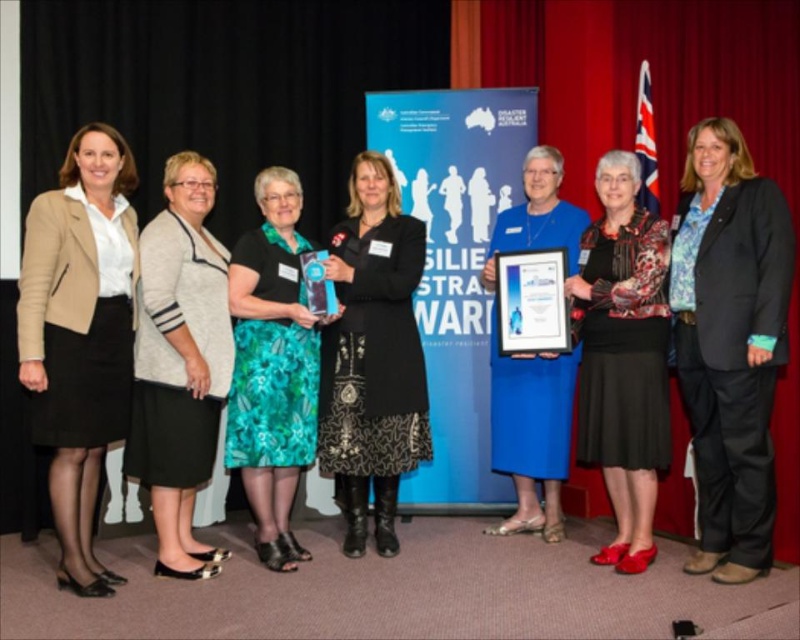
Question: Considering the relative positions of black textured dress at center and floral dress at center in the image provided, where is black textured dress at center located with respect to floral dress at center?

Choices:
 (A) right
 (B) left

Answer: (A)

Question: Can you confirm if beige fabric blazer at left is positioned above printed floral blouse at center?

Choices:
 (A) no
 (B) yes

Answer: (B)

Question: Estimate the real-world distances between objects in this image. Which object is farther from the black fabric jacket at center?

Choices:
 (A) light gray knit cardigan at center
 (B) black textured dress at center
 (C) printed floral blouse at center

Answer: (A)

Question: Which of the following is the farthest from the observer?

Choices:
 (A) (644, 317)
 (B) (696, 317)
 (C) (308, 403)

Answer: (C)

Question: Can you confirm if black fabric jacket at center is positioned to the right of floral dress at center?

Choices:
 (A) yes
 (B) no

Answer: (A)

Question: Which point is closer to the camera?

Choices:
 (A) black fabric jacket at center
 (B) printed floral blouse at center

Answer: (A)